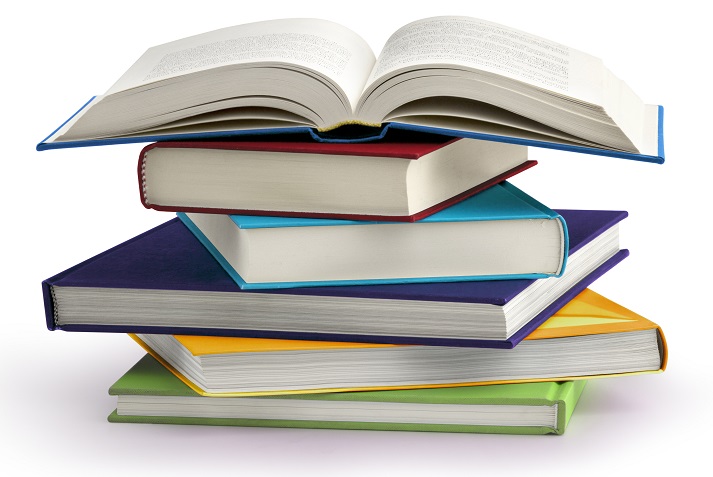
Identify the location of book spines. (142, 186), (563, 248), (46, 307), (662, 352), (560, 420), (361, 137).